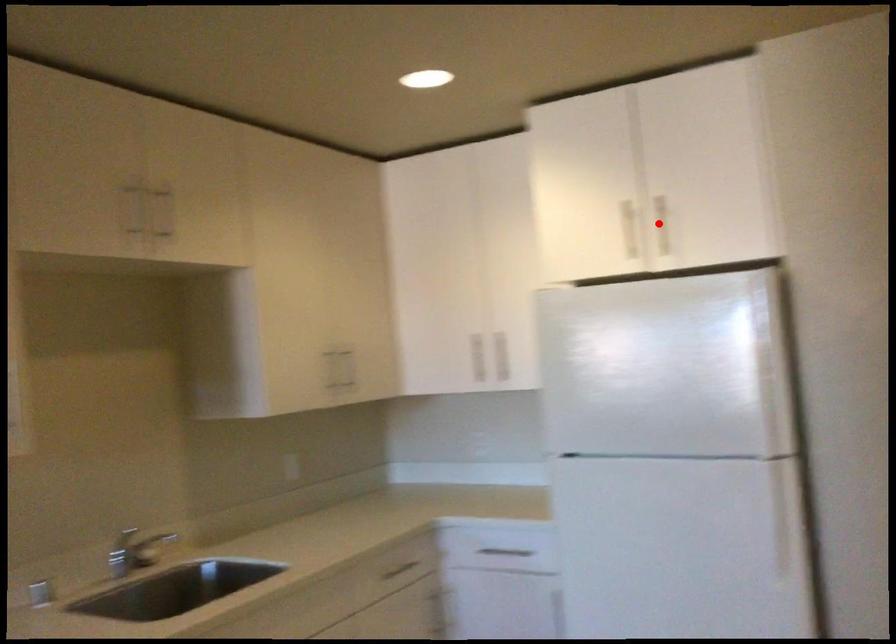
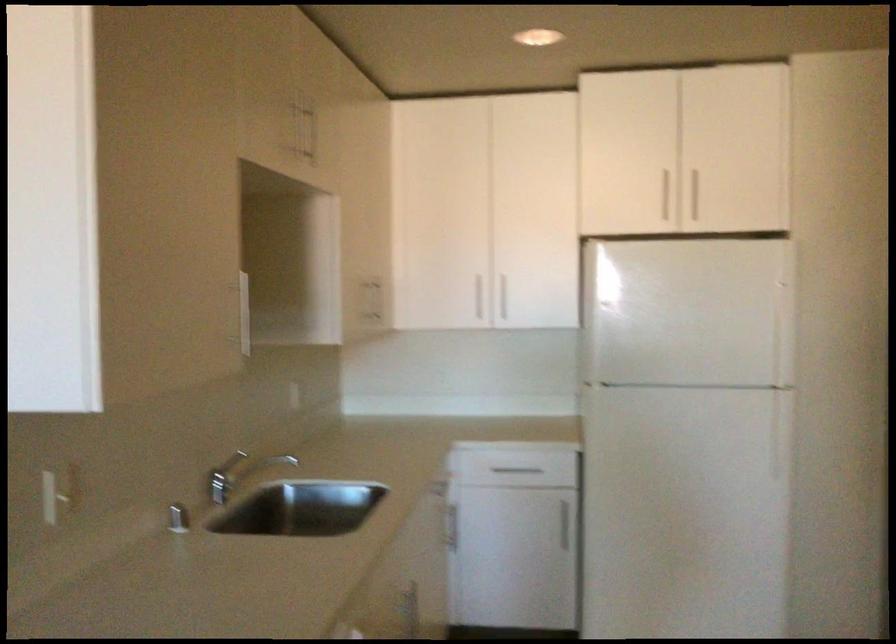
In the second image, find the point that corresponds to the highlighted location in the first image.

(695, 196)